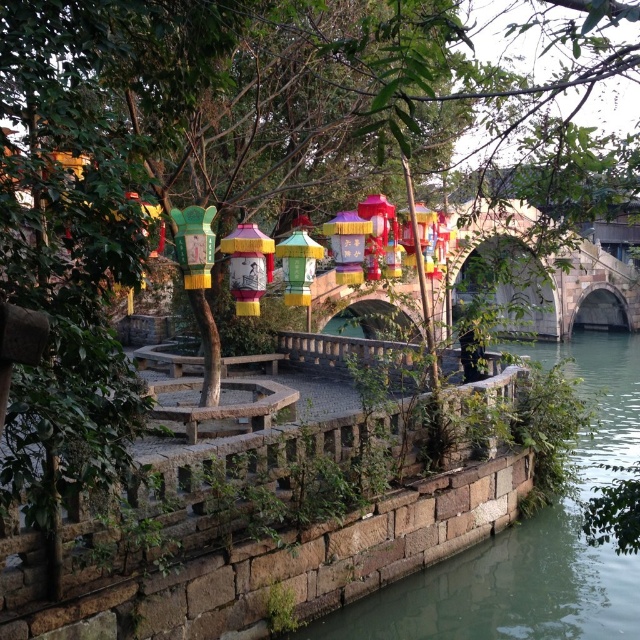
From the picture: You are a visitor at this scenic spot and want to take a photo that includes both the stone arch bridge at center and the multicolored paper lantern at center. Since you want the bridge to look more prominent in the photo, which object should you position closer to the camera?

To make the stone arch bridge at center appear more prominent in the photo, position it closer to the camera since it is taller than the multicolored paper lantern at center.